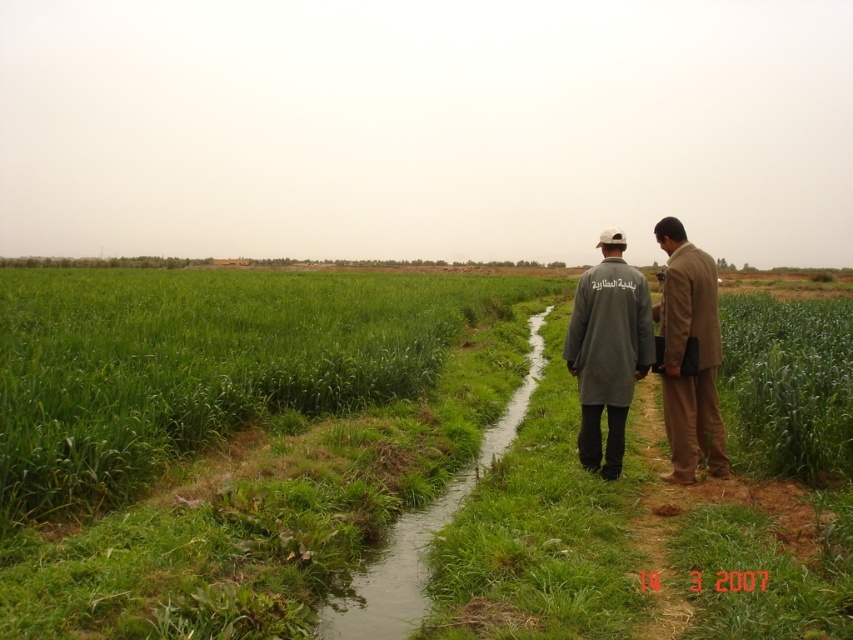
Question: Can you confirm if gray fabric coat at center is thinner than brown fabric suit at right?

Choices:
 (A) no
 (B) yes

Answer: (B)

Question: Which object appears farthest from the camera in this image?

Choices:
 (A) brown fabric suit at right
 (B) green grass at center
 (C) green grassy path at center

Answer: (A)

Question: Which point is farther to the camera?

Choices:
 (A) brown fabric suit at right
 (B) green grassy path at center
 (C) green grass at center
 (D) gray fabric coat at center

Answer: (A)

Question: Based on their relative distances, which object is farther from the green grassy path at center?

Choices:
 (A) brown fabric suit at right
 (B) gray fabric coat at center
 (C) green grass at center

Answer: (C)

Question: Is the position of green grass at center less distant than that of brown fabric suit at right?

Choices:
 (A) yes
 (B) no

Answer: (A)

Question: Is green grassy path at center above gray fabric coat at center?

Choices:
 (A) no
 (B) yes

Answer: (A)